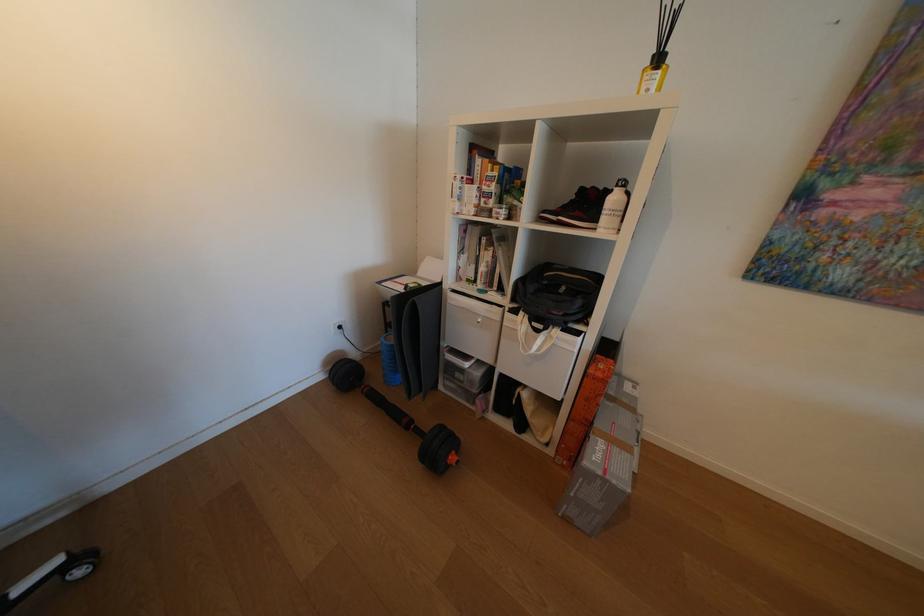
Describe the element at coordinates (535, 323) in the screenshot. Image resolution: width=924 pixels, height=616 pixels. I see `the backpack handle` at that location.